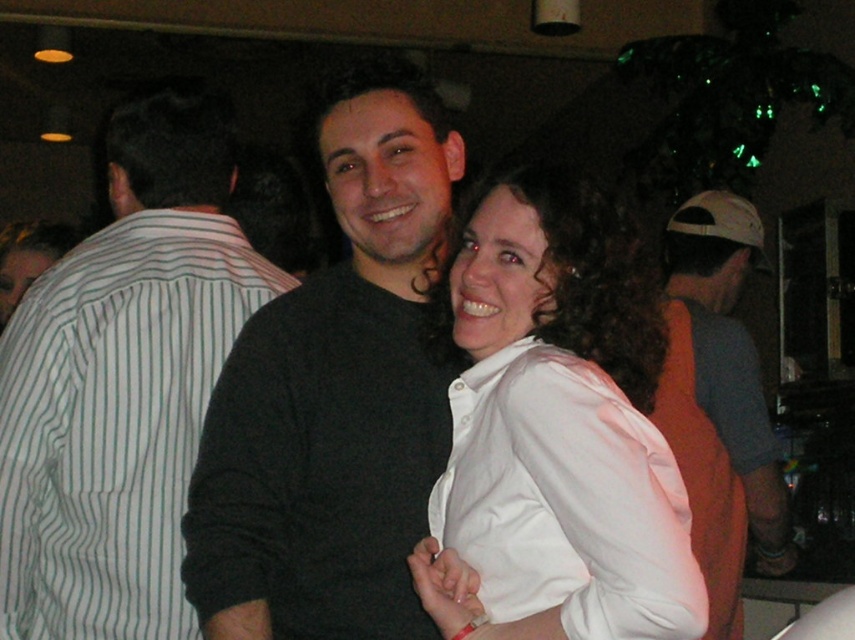
You are at a party and want to take a photo of the black matte sweater at center and the white striped shirt at left. Since you want to ensure both are visible clearly, which one should you focus on first?

The black matte sweater at center is in front of the white striped shirt at left, so you should focus on the black matte sweater at center first to ensure it is in clear view before adjusting for the background subject.

You are organizing a photo album and want to ensure that the black matte sweater at center and the white striped shirt at left are displayed in order of their visual prominence. Based on the image, which object should be placed first?

The white striped shirt at left should be placed first because it occupies more space in the image compared to the black matte sweater at center, which takes up less space.

You are at a party and want to take a photo of the two people in the center. You notice two points marked in the image. Which point is closer to the camera, point (269, 515) or point (184, 339)?

Point (269, 515) is in front of point (184, 339), so it is closer to the camera.